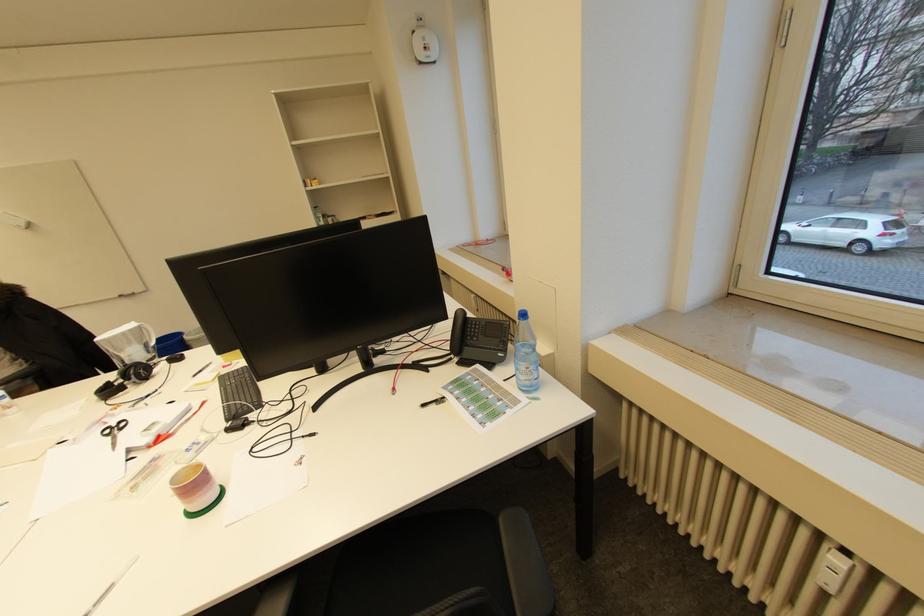
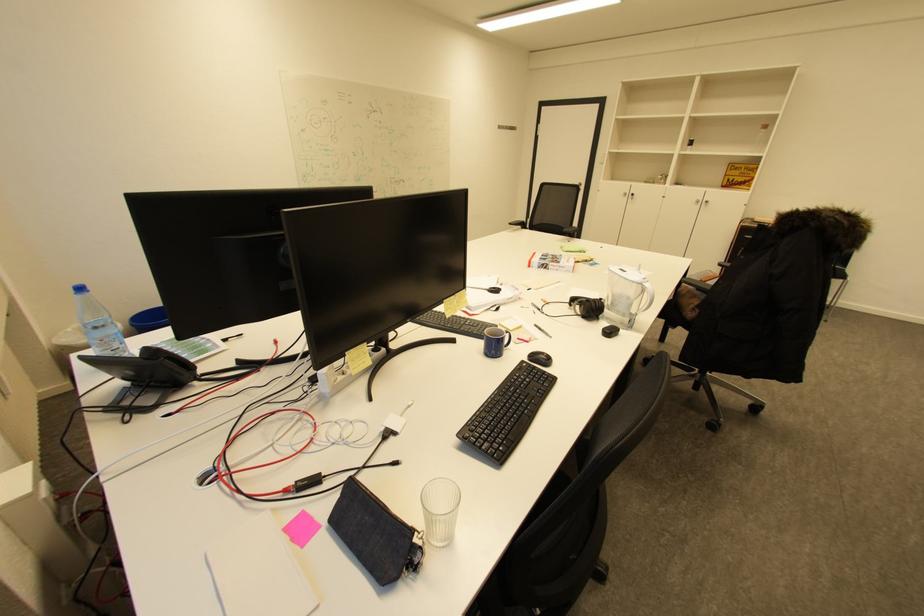
Find the pixel in the second image that matches point (127, 422) in the first image.

(505, 292)